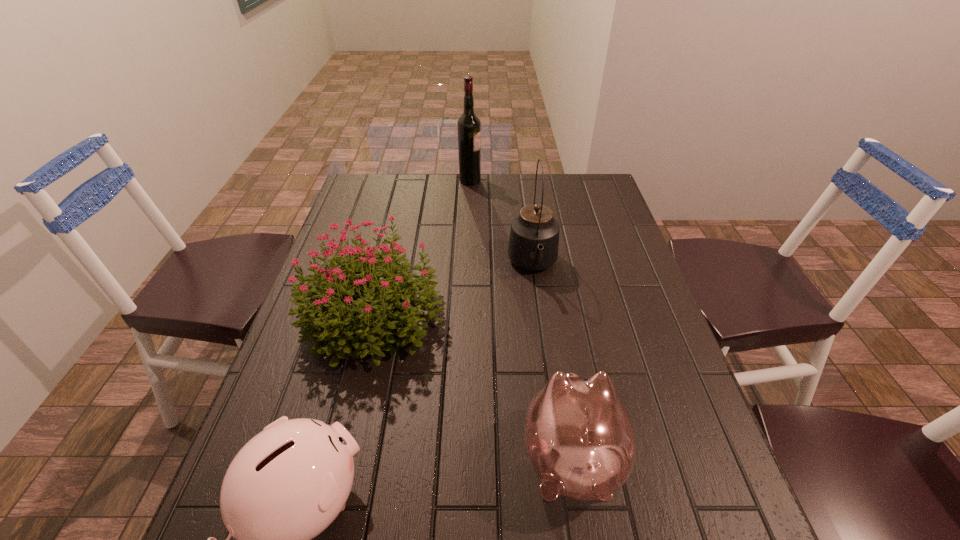
Where is `the tallest object`? The height and width of the screenshot is (540, 960). the tallest object is located at coordinates (468, 125).

Image resolution: width=960 pixels, height=540 pixels. I want to click on the third object from left to right, so click(468, 125).

Locate an element on the screen. kettle is located at coordinates (534, 236).

The width and height of the screenshot is (960, 540). What are the coordinates of `bouquet` in the screenshot? It's located at (322, 310).

What are the coordinates of `the right piggy bank` in the screenshot? It's located at (580, 440).

You are a GUI agent. You are given a task and a screenshot of the screen. Output one action in this format:
    pyautogui.click(x=<x>, y=<y>)
    Task: Click on the blank space located on the front and back of the third object from right to left
    
    Given the screenshot: What is the action you would take?
    pyautogui.click(x=539, y=180)

At what (x,y) coordinates should I click in order to perform the action: click on free space located spout on the kettle. Please return your answer as a coordinate pair (x, y). The width and height of the screenshot is (960, 540). Looking at the image, I should click on pyautogui.click(x=539, y=308).

I want to click on vacant point located 0.370m on the back of the bouquet, so click(402, 198).

Locate an element on the screen. vacant space located on the front facing side of the right piggy bank is located at coordinates (554, 350).

This screenshot has width=960, height=540. Find the location of `vacant space located on the front facing side of the right piggy bank`. vacant space located on the front facing side of the right piggy bank is located at coordinates (548, 313).